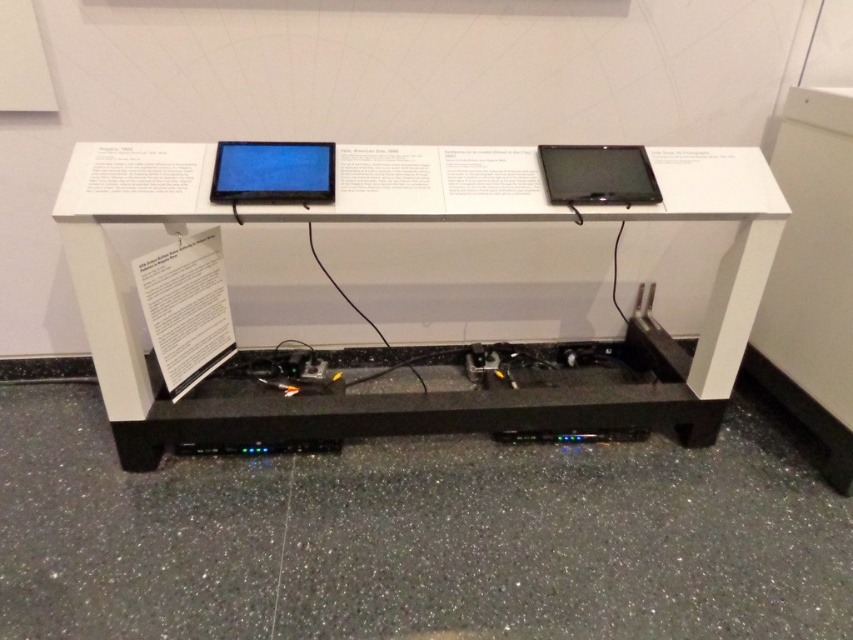
Question: Which point is farther from the camera taking this photo?

Choices:
 (A) (578, 192)
 (B) (480, 211)
 (C) (276, 170)

Answer: (A)

Question: Which of these objects is positioned closest to the matte black laptop at upper right?

Choices:
 (A) matte black laptop at center
 (B) white matte table at center

Answer: (B)

Question: Does white matte table at center appear over matte black laptop at upper right?

Choices:
 (A) no
 (B) yes

Answer: (A)

Question: Is white matte table at center bigger than matte black laptop at center?

Choices:
 (A) yes
 (B) no

Answer: (A)

Question: Among these points, which one is farthest from the camera?

Choices:
 (A) (541, 417)
 (B) (553, 186)

Answer: (A)

Question: Does white matte table at center appear over matte black laptop at center?

Choices:
 (A) yes
 (B) no

Answer: (B)